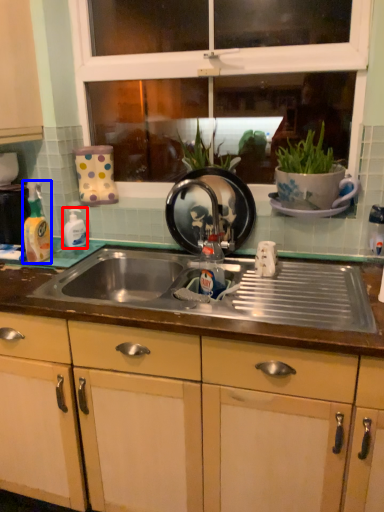
Question: Which of the following is the farthest to the observer, bottle (highlighted by a red box) or bottle (highlighted by a blue box)?

Choices:
 (A) bottle
 (B) bottle

Answer: (A)